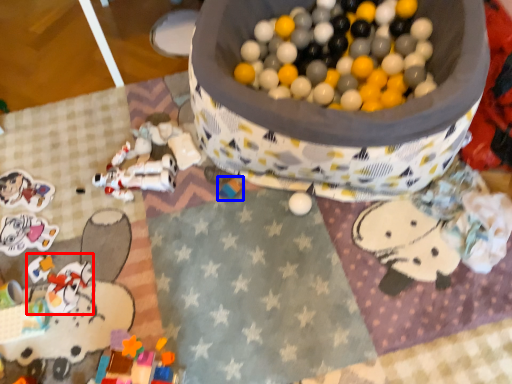
Question: Which of the following is the closest to the observer, toy (highlighted by a red box) or toy (highlighted by a blue box)?

Choices:
 (A) toy
 (B) toy

Answer: (A)